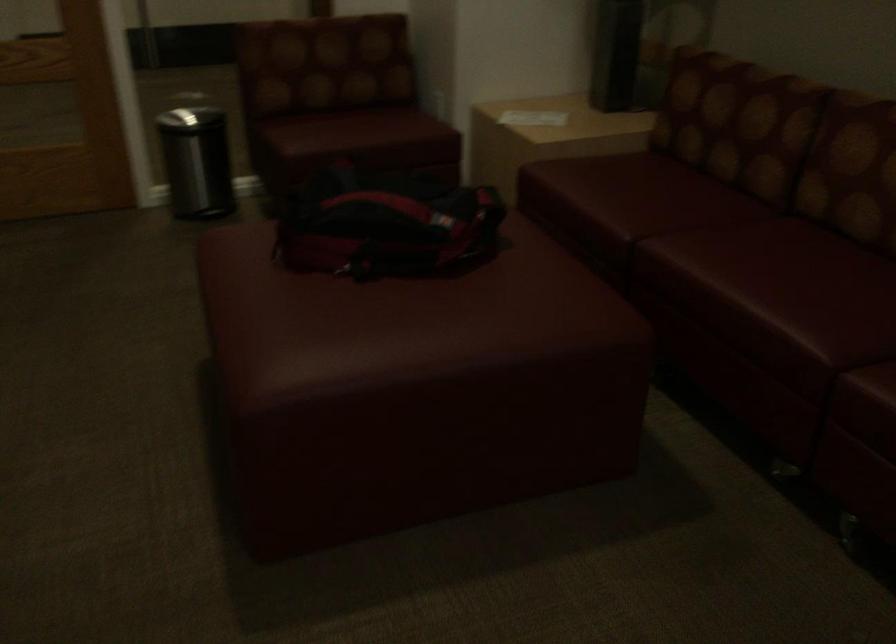
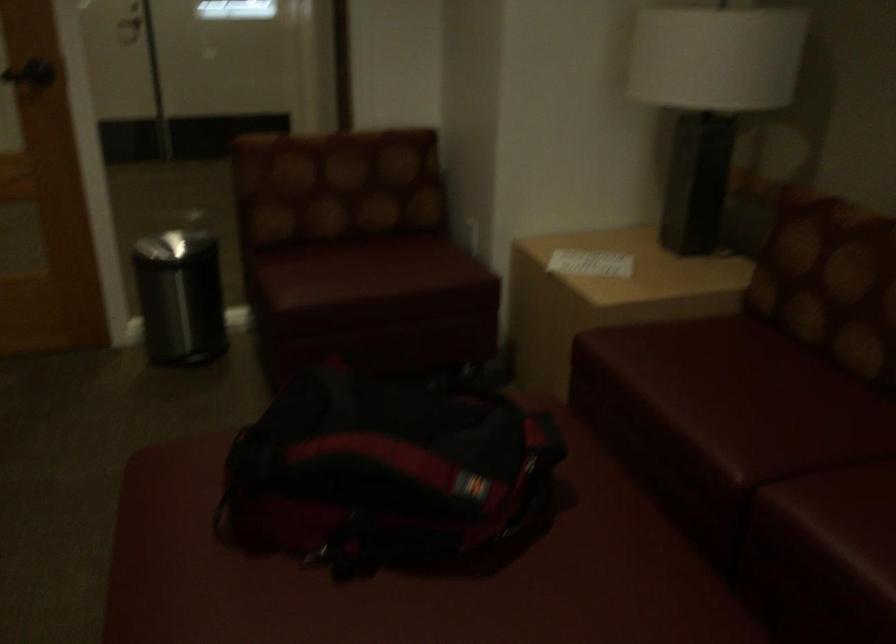
Where in the second image is the point corresponding to the point at 631,193 from the first image?

(731, 397)